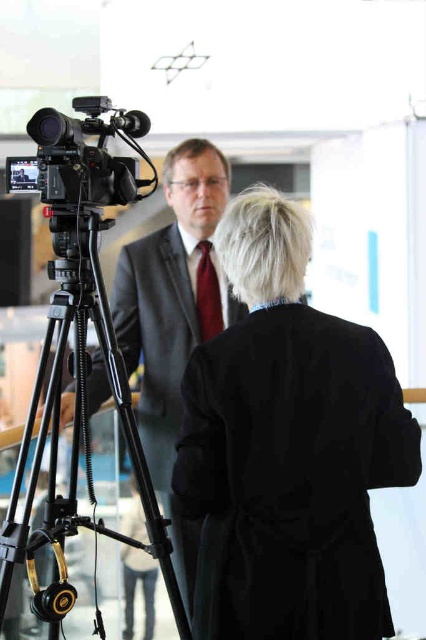
From the picture: Which of these two, black matte camera at left or maroon silk tie at center, stands shorter?

With less height is black matte camera at left.

Does black matte camera at left have a greater height compared to maroon silk tie at center?

No.

Is point (108, 168) in front of point (215, 323)?

Yes, point (108, 168) is closer to viewer.

At what (x,y) coordinates should I click in order to perform the action: click on black matte camera at left. Please return your answer as a coordinate pair (x, y). Looking at the image, I should click on (83, 156).

Can you confirm if black matte coat at center is thinner than black matte camera at left?

Incorrect, black matte coat at center's width is not less than black matte camera at left's.

Does black matte coat at center have a greater height compared to black matte camera at left?

Correct, black matte coat at center is much taller as black matte camera at left.

Who is more distant from viewer, (x=328, y=486) or (x=48, y=170)?

Point (x=48, y=170)

The width and height of the screenshot is (426, 640). Identify the location of black matte coat at center. (287, 448).

Consider the image. Does black matte coat at center have a larger size compared to maroon silk tie at center?

Indeed, black matte coat at center has a larger size compared to maroon silk tie at center.

In the scene shown: Does black matte coat at center appear on the right side of maroon silk tie at center?

Indeed, black matte coat at center is positioned on the right side of maroon silk tie at center.

Does point (305, 531) lie in front of point (212, 291)?

Yes, it is in front of point (212, 291).

Find the location of a particular element. The image size is (426, 640). black matte coat at center is located at coordinates (287, 448).